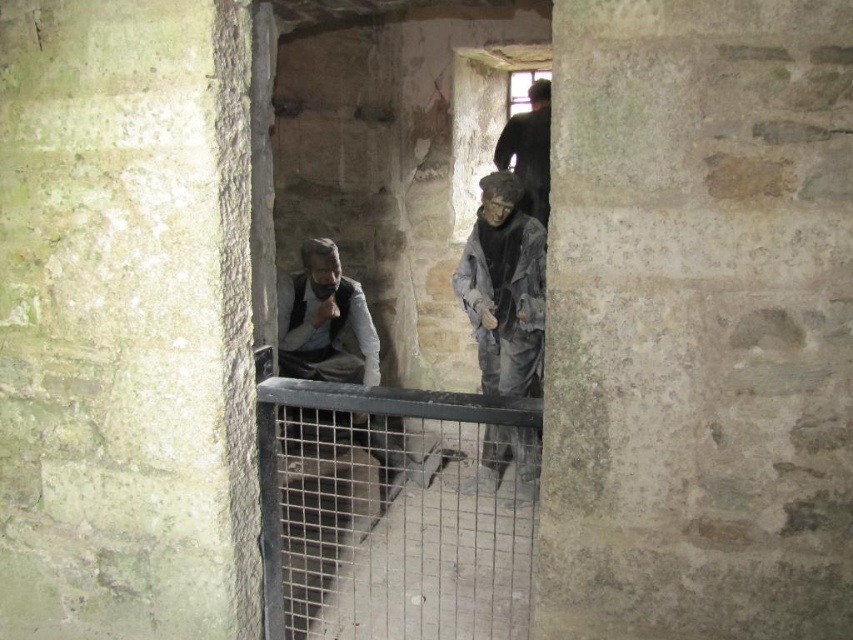
You are a tour guide leading a group through this historical museum exhibit. You need to explain the distance between the green stone pillar at left and the gray fabric figure at center to your visitors. What do you tell them?

The green stone pillar at left and the gray fabric figure at center are 7.22 feet apart from each other.

Looking at this image, you are a visitor standing outside the metal gate in the foreground. You want to take a photo of the gray fabric figure at center without the green stone pillar at left blocking the view. Is this possible?

The green stone pillar at left is positioned over the gray fabric figure at center, so taking a photo without the pillar blocking the view would not be possible from your current position outside the metal gate.

You are a visitor in the museum and want to take a photo of the gray fabric figure at center and the dark gray fabric at upper center. How far apart are these two objects in the scene?

The gray fabric figure at center is 39.07 inches from the dark gray fabric at upper center.